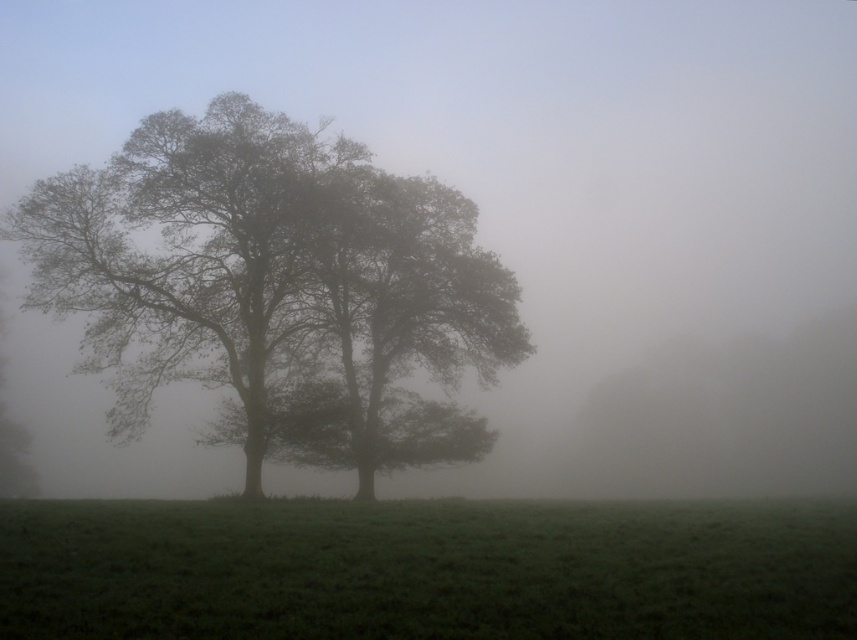
You are a hiker standing on the green grassy field at center. You want to take a photo of the dark gray textured tree at center. Which direction should you face to ensure the tree is fully visible in your camera frame?

The dark gray textured tree at center is taller than the green grassy field at center, so you should face upward to ensure the tree is fully visible in your camera frame.

You are a hiker standing on the green grassy field at center. You want to take a photo of the dark gray textured tree at center. Which direction should you face to ensure the tree is fully visible in your camera frame?

The dark gray textured tree at center is positioned over the green grassy field at center, so facing forward will ensure the tree is fully visible in your camera frame.